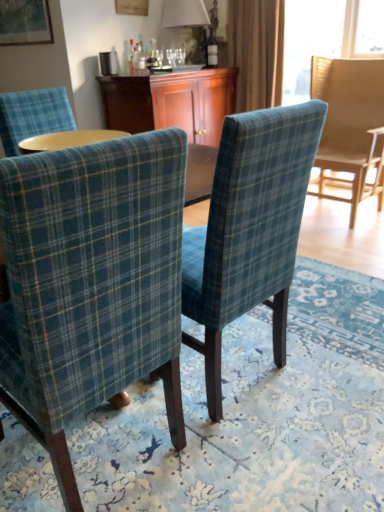
Question: In terms of height, does wooden cabinet at center look taller or shorter compared to blue plaid fabric chair at center, which is counted as the second chair, starting from the right?

Choices:
 (A) short
 (B) tall

Answer: (A)

Question: Do you think wooden cabinet at center is within blue plaid fabric chair at center, which is counted as the second chair, starting from the front, or outside of it?

Choices:
 (A) inside
 (B) outside

Answer: (B)

Question: Estimate the real-world distances between objects in this image. Which object is farther from the plaid fabric chair at center, the 3th chair when ordered from right to left?

Choices:
 (A) velvet curtain at upper center
 (B) teal plaid chair at right, which is counted as the third chair, starting from the front
 (C) wooden cabinet at center
 (D) blue plaid fabric chair at center, the 2th chair in the back-to-front sequence
 (E) matte white lampshade at upper center

Answer: (E)

Question: Which object is the farthest from the velvet curtain at upper center?

Choices:
 (A) wooden cabinet at center
 (B) blue plaid fabric chair at center, which is counted as the second chair, starting from the right
 (C) teal plaid chair at right, which is counted as the third chair, starting from the front
 (D) plaid fabric chair at center, placed as the 3th chair when sorted from back to front
 (E) matte white lampshade at upper center

Answer: (D)